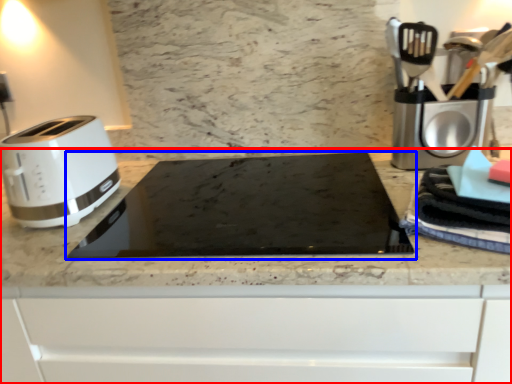
Question: Which of the following is the farthest to the observer, countertop (highlighted by a red box) or home appliance (highlighted by a blue box)?

Choices:
 (A) countertop
 (B) home appliance

Answer: (B)